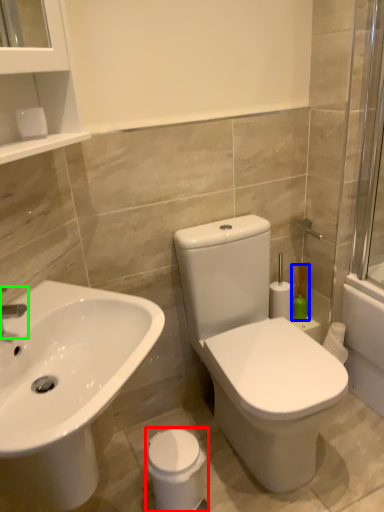
Question: Estimate the real-world distances between objects in this image. Which object is farther from porcelain (highlighted by a red box), soap dispenser (highlighted by a blue box) or tap (highlighted by a green box)?

Choices:
 (A) soap dispenser
 (B) tap

Answer: (A)